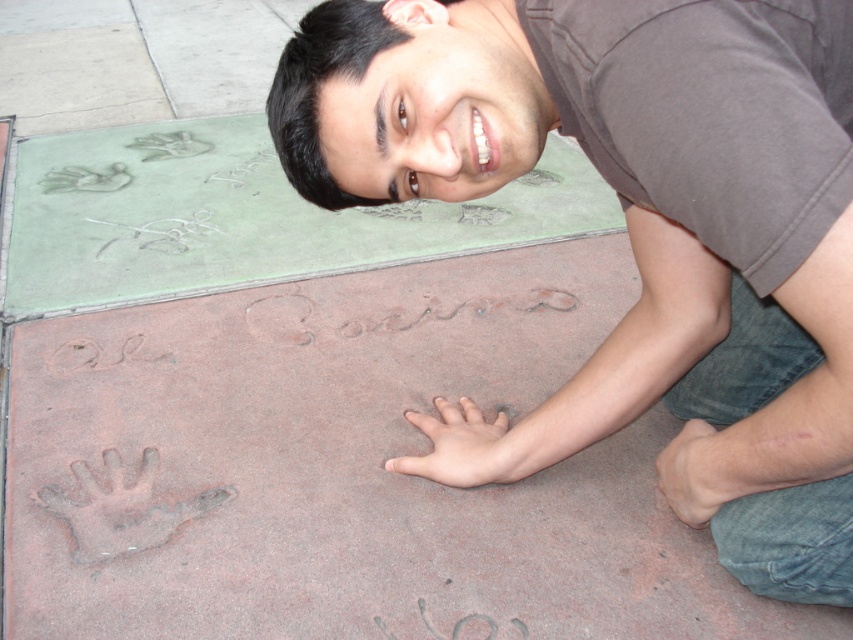
Is matte brown shirt at center to the right of pink flesh-colored hand at center from the viewer's perspective?

Yes, matte brown shirt at center is to the right of pink flesh-colored hand at center.

Between matte brown shirt at center and pink flesh-colored hand at center, which one is positioned higher?

matte brown shirt at center is higher up.

Locate an element on the screen. matte brown shirt at center is located at coordinates (637, 211).

The image size is (853, 640). Find the location of `matte brown shirt at center`. matte brown shirt at center is located at coordinates (637, 211).

Measure the distance between point (433, 403) and camera.

Point (433, 403) and camera are 4.55 feet apart.

Does point (503, 429) come in front of point (701, 435)?

No, (503, 429) is further to viewer.

Find the location of a particular element. pink flesh-colored hand at center is located at coordinates (467, 448).

Locate an element on the screen. The image size is (853, 640). pink flesh-colored hand at center is located at coordinates (467, 448).

Which is behind, point (737, 230) or point (672, 461)?

Positioned behind is point (672, 461).

Between point (376, 122) and point (741, 481), which one is positioned in front?

Positioned in front is point (376, 122).

This screenshot has width=853, height=640. Describe the element at coordinates (637, 211) in the screenshot. I see `matte brown shirt at center` at that location.

Where is `matte brown shirt at center`? This screenshot has height=640, width=853. matte brown shirt at center is located at coordinates (637, 211).